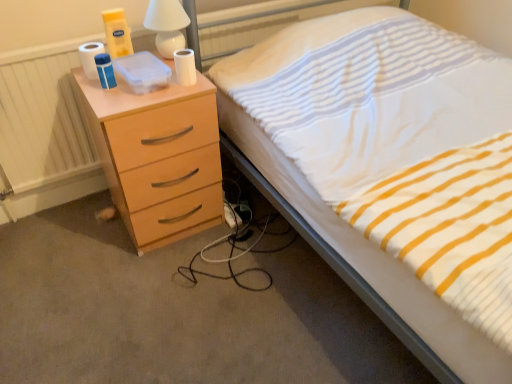
Question: Is white matte toilet paper at upper left, marked as the 1th toilet paper in a left-to-right arrangement, oriented towards white matte toilet paper at upper center, the 1th toilet paper viewed from the right?

Choices:
 (A) yes
 (B) no

Answer: (B)

Question: Is white matte toilet paper at upper left, acting as the 2th toilet paper starting from the right, outside white matte toilet paper at upper center, positioned as the second toilet paper in left-to-right order?

Choices:
 (A) no
 (B) yes

Answer: (B)

Question: Does white matte toilet paper at upper left, acting as the 2th toilet paper starting from the right, have a lesser width compared to white matte toilet paper at upper center, positioned as the second toilet paper in left-to-right order?

Choices:
 (A) yes
 (B) no

Answer: (B)

Question: Is white matte toilet paper at upper left, marked as the 1th toilet paper in a left-to-right arrangement, to the right of white matte toilet paper at upper center, the 1th toilet paper viewed from the right, from the viewer's perspective?

Choices:
 (A) yes
 (B) no

Answer: (B)

Question: From a real-world perspective, is white matte toilet paper at upper left, acting as the 2th toilet paper starting from the right, located beneath white matte toilet paper at upper center, positioned as the second toilet paper in left-to-right order?

Choices:
 (A) yes
 (B) no

Answer: (B)

Question: Does point (228, 223) appear closer or farther from the camera than point (192, 92)?

Choices:
 (A) closer
 (B) farther

Answer: (B)

Question: Do you think white fabric extension cord at lower center is within matte wood chest of drawers at left, or outside of it?

Choices:
 (A) inside
 (B) outside

Answer: (B)

Question: From a real-world perspective, is white fabric extension cord at lower center positioned above or below matte wood chest of drawers at left?

Choices:
 (A) below
 (B) above

Answer: (A)

Question: From their relative heights in the image, would you say white fabric extension cord at lower center is taller or shorter than matte wood chest of drawers at left?

Choices:
 (A) tall
 (B) short

Answer: (B)

Question: Considering their positions, is white fabric extension cord at lower center located in front of or behind white glossy lamp at upper center?

Choices:
 (A) behind
 (B) front

Answer: (A)

Question: Is white fabric extension cord at lower center bigger or smaller than white glossy lamp at upper center?

Choices:
 (A) small
 (B) big

Answer: (A)

Question: Is point (237, 223) positioned closer to the camera than point (159, 18)?

Choices:
 (A) closer
 (B) farther

Answer: (B)

Question: Is white fabric extension cord at lower center inside or outside of white glossy lamp at upper center?

Choices:
 (A) outside
 (B) inside

Answer: (A)

Question: Is white fabric extension cord at lower center wider or thinner than white matte toilet paper at upper left, marked as the 1th toilet paper in a left-to-right arrangement?

Choices:
 (A) wide
 (B) thin

Answer: (A)

Question: Is white fabric extension cord at lower center spatially inside white matte toilet paper at upper left, acting as the 2th toilet paper starting from the right, or outside of it?

Choices:
 (A) outside
 (B) inside

Answer: (A)